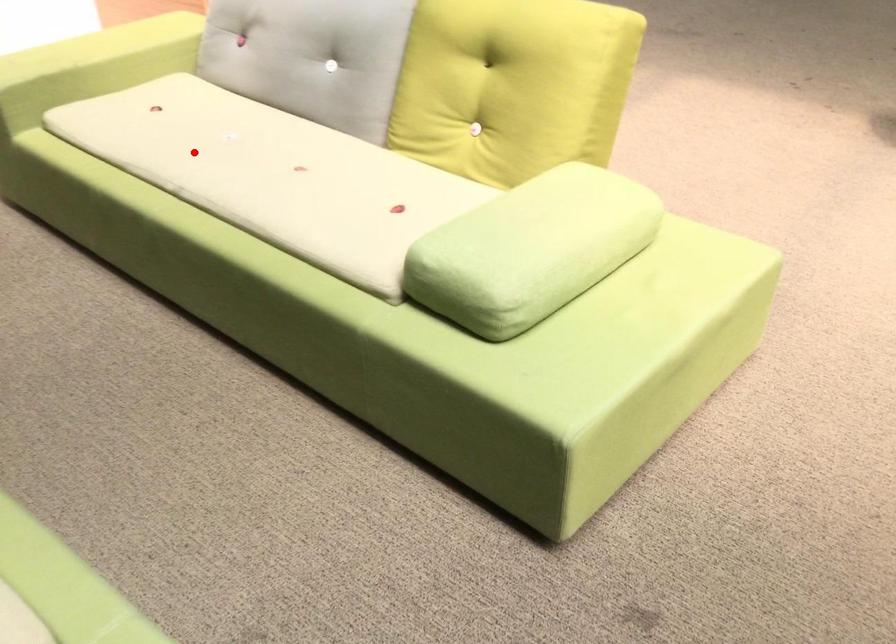
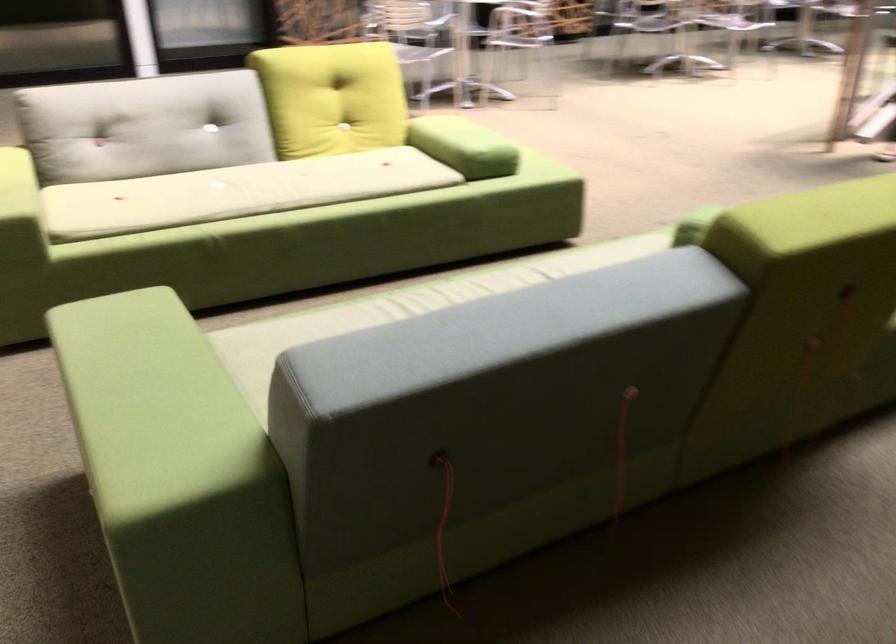
In the second image, find the point that corresponds to the highlighted location in the first image.

(236, 192)